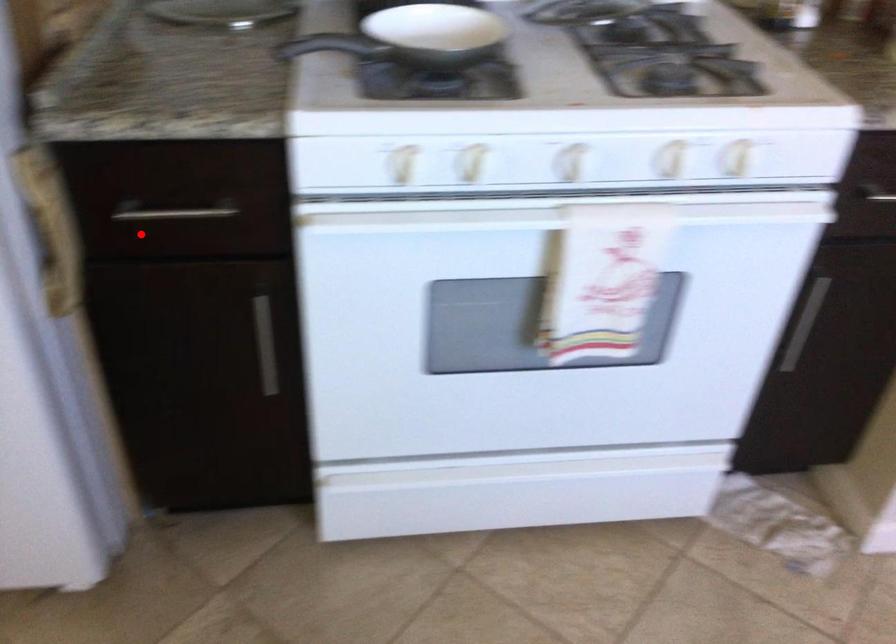
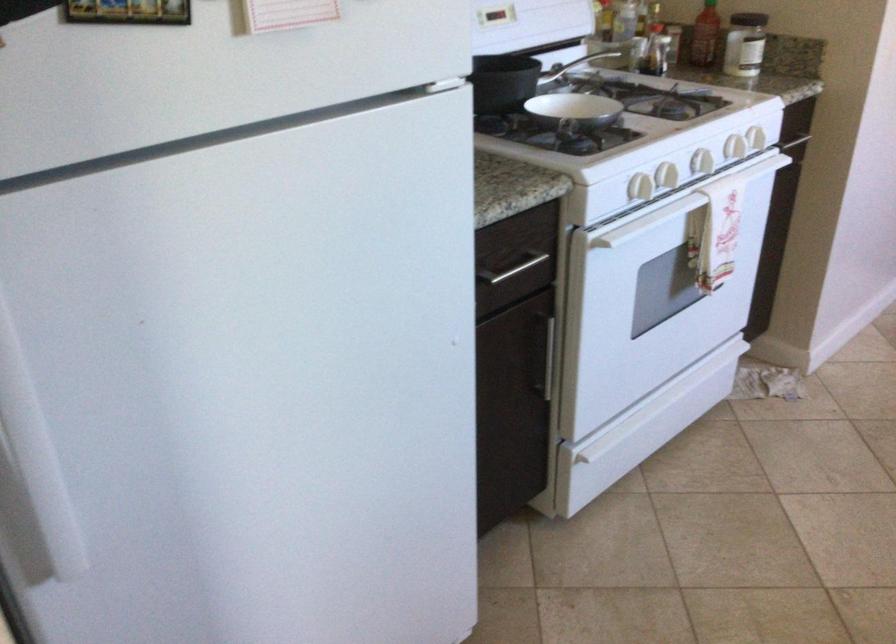
Question: I am providing you with two images of the same scene from different viewpoints. Image1 has a red point marked. In image2, the corresponding 3D location appears at what relative position? Reply with the corresponding letter.

Choices:
 (A) Closer
 (B) Farther

Answer: (B)